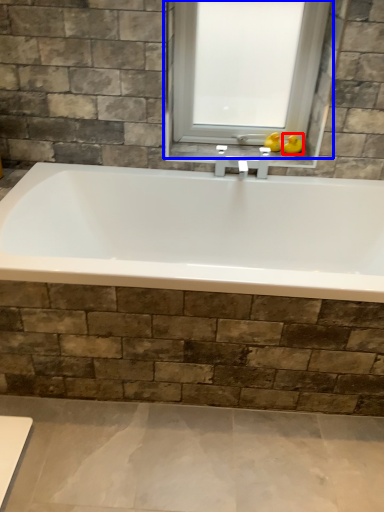
Question: Which object is closer to the camera taking this photo, duck (highlighted by a red box) or window (highlighted by a blue box)?

Choices:
 (A) duck
 (B) window

Answer: (B)